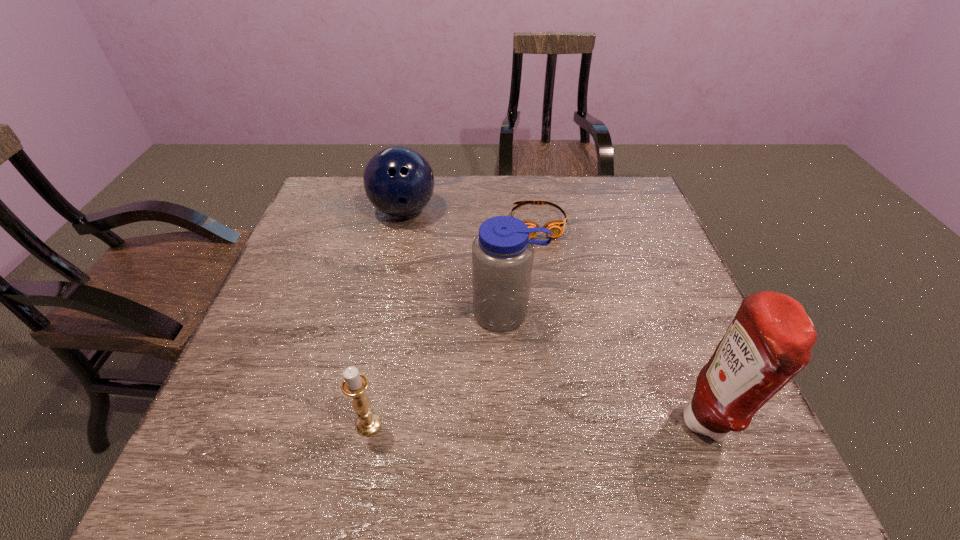
This screenshot has height=540, width=960. What are the coordinates of `free space that satisfies the following two spatial constraints: 1. on the back side of the rightmost object; 2. on the left side of the candle holder` in the screenshot? It's located at (369, 423).